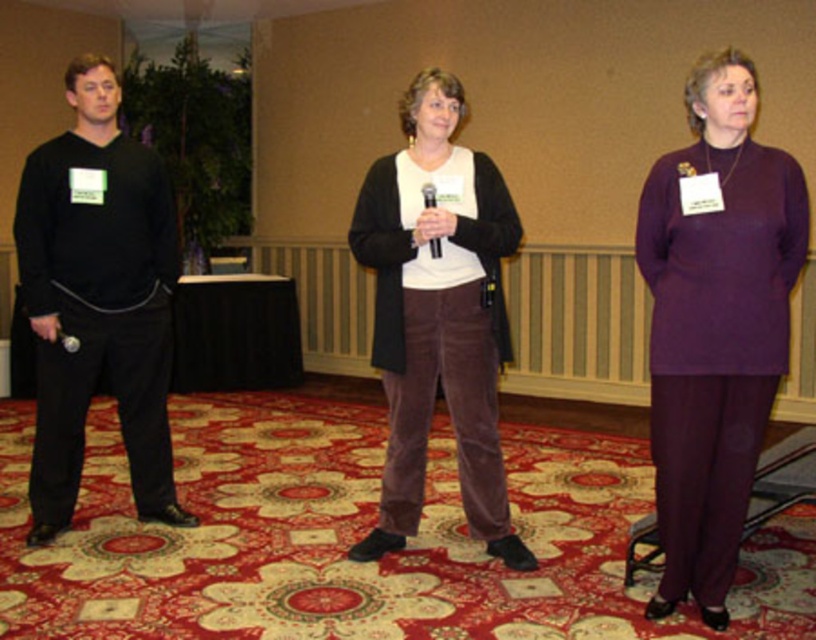
Question: Can you confirm if black matte pants at left is bigger than velvet brown pants at center?

Choices:
 (A) yes
 (B) no

Answer: (A)

Question: Is purple matte pants at center behind matte black microphone at lower left?

Choices:
 (A) no
 (B) yes

Answer: (A)

Question: Which point appears farthest from the camera in this image?

Choices:
 (A) (135, 388)
 (B) (74, 339)
 (C) (389, 452)

Answer: (A)

Question: Which object is the farthest from the black matte pants at left?

Choices:
 (A) velvet brown pants at center
 (B) purple matte pants at center
 (C) matte black microphone at lower left

Answer: (B)

Question: Which point is closer to the camera taking this photo?

Choices:
 (A) (116, 93)
 (B) (438, 257)
 (C) (63, 333)

Answer: (B)

Question: Can you confirm if velvet brown pants at center is positioned to the right of black plastic microphone at center?

Choices:
 (A) yes
 (B) no

Answer: (B)